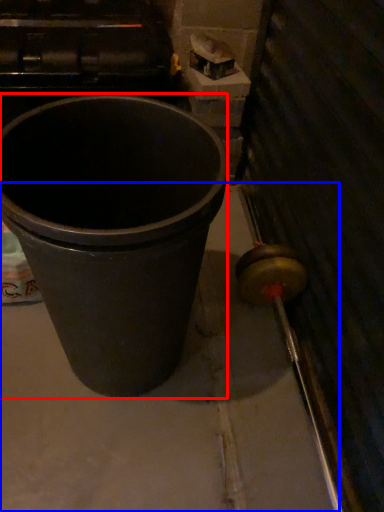
Question: Among these objects, which one is nearest to the camera, waste container (highlighted by a red box) or concrete (highlighted by a blue box)?

Choices:
 (A) waste container
 (B) concrete

Answer: (A)